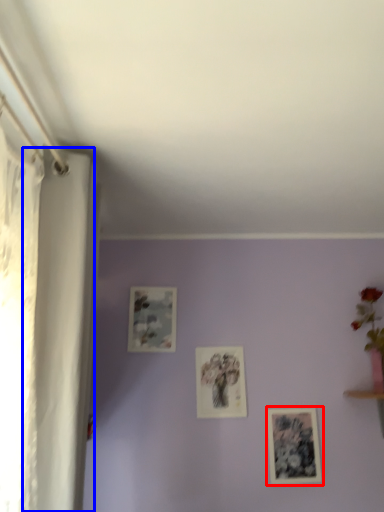
Question: Which of the following is the farthest to the observer, picture frame (highlighted by a red box) or curtain (highlighted by a blue box)?

Choices:
 (A) picture frame
 (B) curtain

Answer: (A)